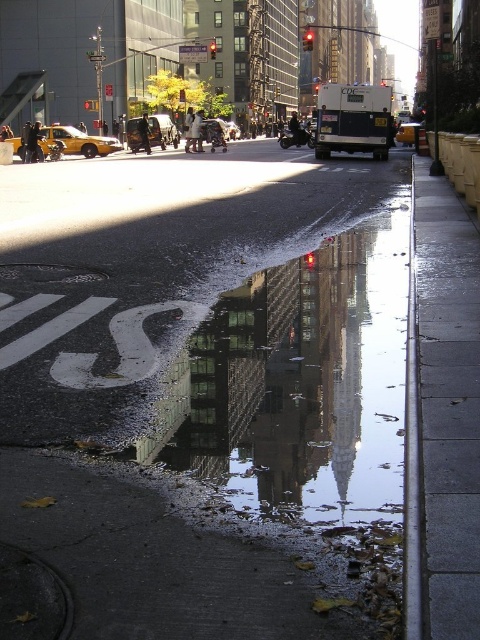
Question: Does reflective glass building at center lie behind metallic silver van at center?

Choices:
 (A) yes
 (B) no

Answer: (B)

Question: Can you confirm if reflective glass building at center is positioned below metallic silver van at center?

Choices:
 (A) yes
 (B) no

Answer: (A)

Question: Which of the following is the farthest from the observer?

Choices:
 (A) (399, 141)
 (B) (355, 435)

Answer: (A)

Question: Which is nearer to the metallic silver van at center?

Choices:
 (A) wet asphalt sidewalk at lower center
 (B) reflective glass building at center
 (C) yellow rubber taxi at left
 (D) yellow rubber taxi at center

Answer: (C)

Question: Does reflective glass building at center have a lesser width compared to yellow rubber taxi at center?

Choices:
 (A) yes
 (B) no

Answer: (A)

Question: Among these objects, which one is nearest to the camera?

Choices:
 (A) reflective glass building at center
 (B) yellow rubber taxi at left

Answer: (A)